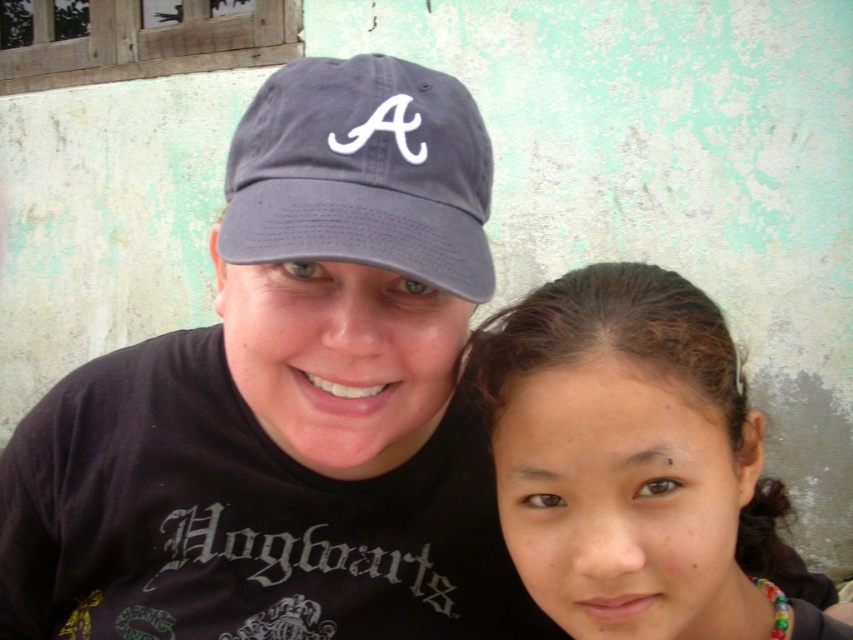
Which is above, matte gray cap at upper left or dark gray fabric baseball cap at center?

dark gray fabric baseball cap at center

This screenshot has width=853, height=640. What are the coordinates of `matte gray cap at upper left` in the screenshot? It's located at (289, 401).

Measure the distance from brown hair at lower right to dark gray fabric baseball cap at center.

The distance of brown hair at lower right from dark gray fabric baseball cap at center is 16.94 centimeters.

Is point (608, 408) farther from camera compared to point (351, 68)?

No, it is in front of (351, 68).

Which is behind, point (666, 554) or point (323, 230)?

Positioned behind is point (666, 554).

At what (x,y) coordinates should I click in order to perform the action: click on brown hair at lower right. Please return your answer as a coordinate pair (x, y). The height and width of the screenshot is (640, 853). Looking at the image, I should click on (630, 458).

Which is more to the left, matte gray cap at upper left or brown hair at lower right?

matte gray cap at upper left is more to the left.

Between point (341, 385) and point (631, 544), which one is positioned behind?

Point (341, 385)

The image size is (853, 640). What do you see at coordinates (289, 401) in the screenshot?
I see `matte gray cap at upper left` at bounding box center [289, 401].

Where is `matte gray cap at upper left`? The height and width of the screenshot is (640, 853). matte gray cap at upper left is located at coordinates (289, 401).